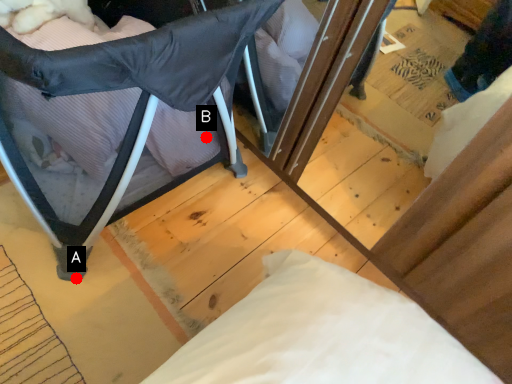
Question: Two points are circled on the image, labeled by A and B beside each circle. Which point appears farthest from the camera in this image?

Choices:
 (A) A is further
 (B) B is further

Answer: (B)